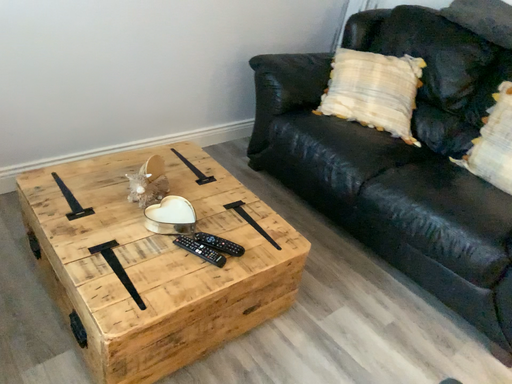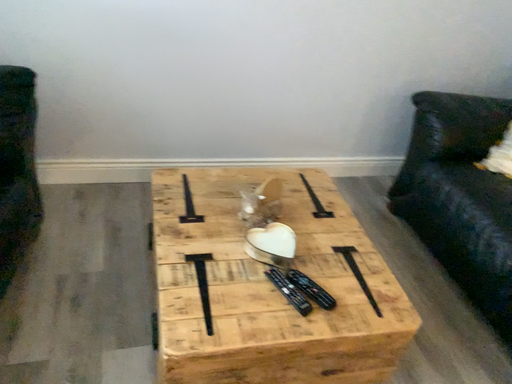
Question: How did the camera likely rotate when shooting the video?

Choices:
 (A) rotated right
 (B) rotated left

Answer: (B)